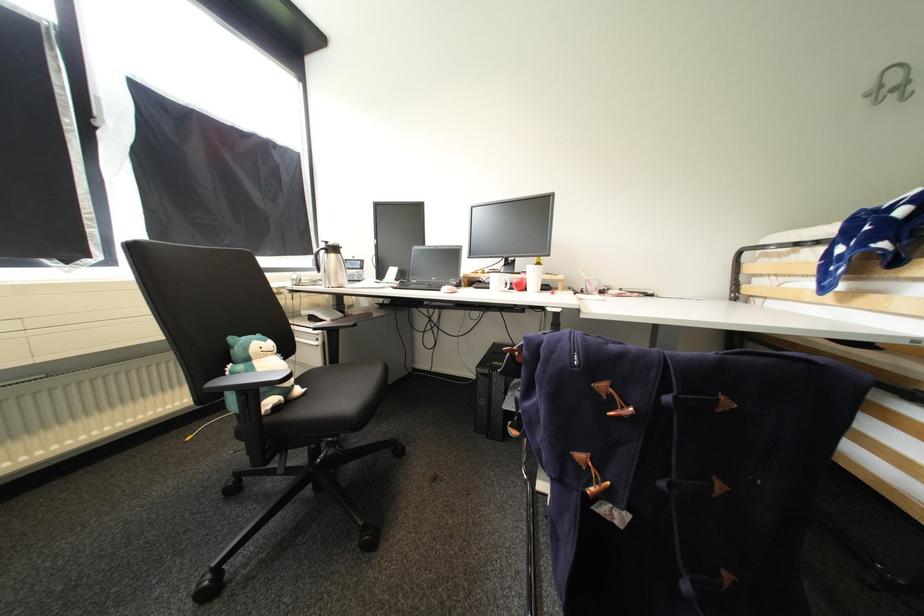
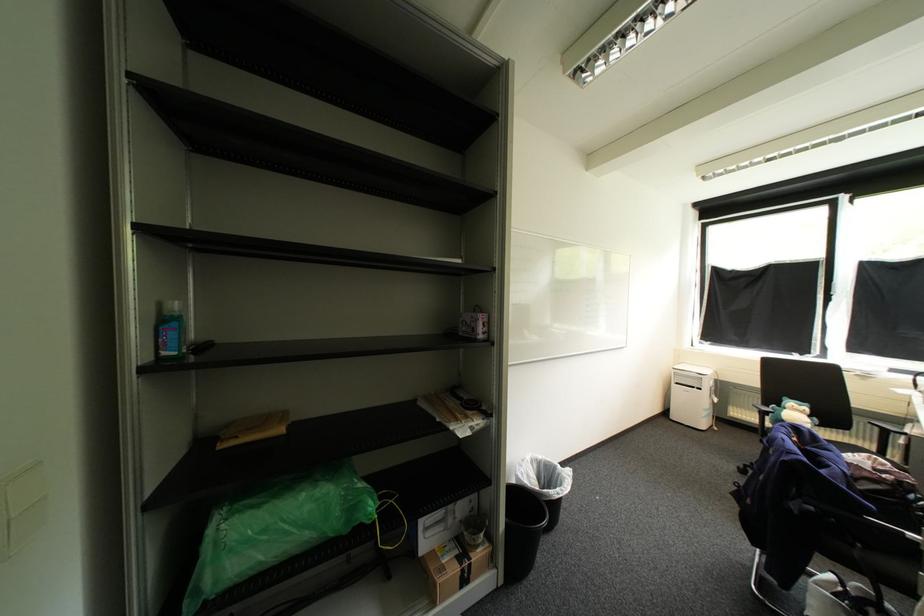
Locate, in the second image, the point that corresponds to (x=254, y=362) in the first image.

(792, 408)